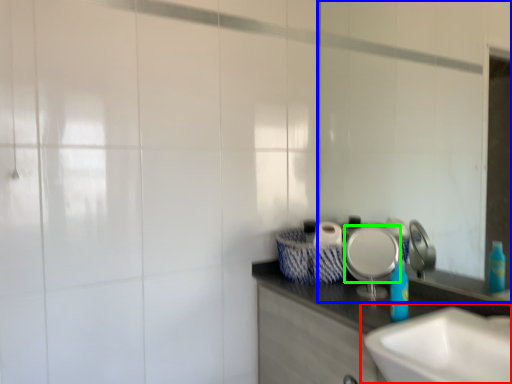
Question: Which object is positioned farthest from sink (highlighted by a red box)? Select from mirror (highlighted by a blue box) and plate (highlighted by a green box).

Choices:
 (A) mirror
 (B) plate

Answer: (A)